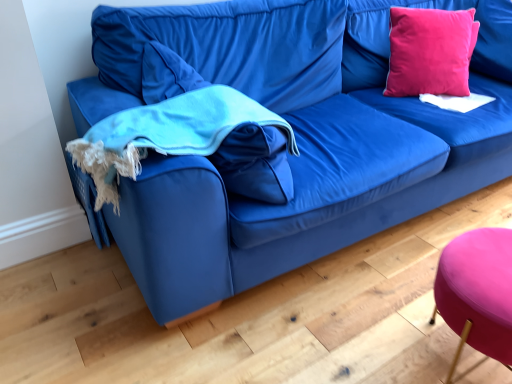
Where is `free space above purple fabric stool at lower right (from a real-world perspective)`? free space above purple fabric stool at lower right (from a real-world perspective) is located at coordinates (486, 251).